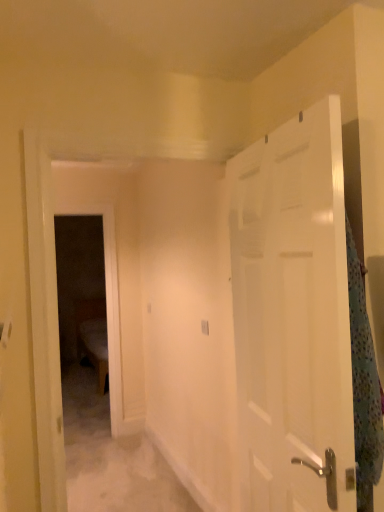
In order to face fluffy polka dot blanket at right, should I rotate leftwards or rightwards?

To face it directly, rotate right by 22.582 degrees.

This screenshot has height=512, width=384. In order to click on fluffy polka dot blanket at right in this screenshot , I will do `click(364, 383)`.

What is the approximate height of fluffy polka dot blanket at right?

fluffy polka dot blanket at right is 25.27 inches in height.

What do you see at coordinates (364, 383) in the screenshot? Image resolution: width=384 pixels, height=512 pixels. I see `fluffy polka dot blanket at right` at bounding box center [364, 383].

This screenshot has width=384, height=512. What do you see at coordinates (293, 317) in the screenshot?
I see `white glossy door at right` at bounding box center [293, 317].

This screenshot has width=384, height=512. In order to click on white glossy door at right in this screenshot , I will do `click(293, 317)`.

Locate an element on the screen. This screenshot has width=384, height=512. fluffy polka dot blanket at right is located at coordinates (364, 383).

Between fluffy polka dot blanket at right and white glossy door at right, which one appears on the left side from the viewer's perspective?

white glossy door at right.

Is fluffy polka dot blanket at right positioned before white glossy door at right?

That is False.

Does point (361, 485) come farther from viewer compared to point (271, 221)?

That is False.

From the image's perspective, which one is positioned higher, fluffy polka dot blanket at right or white glossy door at right?

fluffy polka dot blanket at right, from the image's perspective.

From a real-world perspective, is fluffy polka dot blanket at right on top of white glossy door at right?

Incorrect, from a real-world perspective, fluffy polka dot blanket at right is lower than white glossy door at right.

Between fluffy polka dot blanket at right and white glossy door at right, which one has larger width?

With larger width is white glossy door at right.

In terms of height, does fluffy polka dot blanket at right look taller or shorter compared to white glossy door at right?

Considering their sizes, fluffy polka dot blanket at right has less height than white glossy door at right.

Does fluffy polka dot blanket at right have a smaller size compared to white glossy door at right?

Yes, fluffy polka dot blanket at right is smaller than white glossy door at right.

Based on the photo, is white glossy door at right surrounded by fluffy polka dot blanket at right?

No, white glossy door at right is not inside fluffy polka dot blanket at right.

From the picture: Are fluffy polka dot blanket at right and white glossy door at right making contact?

No, fluffy polka dot blanket at right is not making contact with white glossy door at right.

Is fluffy polka dot blanket at right facing towards white glossy door at right?

No.

Find the location of a particular element. door that is below the fluffy polka dot blanket at right (from the image's perspective) is located at coordinates (293, 317).

Considering the positions of objects white glossy door at right and fluffy polka dot blanket at right in the image provided, who is more to the left, white glossy door at right or fluffy polka dot blanket at right?

Positioned to the left is white glossy door at right.

Is the position of white glossy door at right less distant than that of fluffy polka dot blanket at right?

Yes, white glossy door at right is closer to the camera.

Considering the points (256, 426) and (375, 366), which point is in front, point (256, 426) or point (375, 366)?

Point (375, 366)

From the image's perspective, which object appears higher, white glossy door at right or fluffy polka dot blanket at right?

fluffy polka dot blanket at right is shown above in the image.

From a real-world perspective, is white glossy door at right positioned under fluffy polka dot blanket at right based on gravity?

Incorrect, from a real-world perspective, white glossy door at right is higher than fluffy polka dot blanket at right.

Can you confirm if white glossy door at right is thinner than fluffy polka dot blanket at right?

No, white glossy door at right is not thinner than fluffy polka dot blanket at right.

Can you confirm if white glossy door at right is taller than fluffy polka dot blanket at right?

Yes.

Is white glossy door at right smaller than fluffy polka dot blanket at right?

Actually, white glossy door at right might be larger than fluffy polka dot blanket at right.

Is white glossy door at right spatially inside fluffy polka dot blanket at right, or outside of it?

white glossy door at right is not enclosed by fluffy polka dot blanket at right.

Is white glossy door at right with fluffy polka dot blanket at right?

No, white glossy door at right is not touching fluffy polka dot blanket at right.

Could you tell me if white glossy door at right is turned towards fluffy polka dot blanket at right?

Yes, white glossy door at right faces towards fluffy polka dot blanket at right.

Where is `blanket that is above the white glossy door at right (from the image's perspective)`? The image size is (384, 512). blanket that is above the white glossy door at right (from the image's perspective) is located at coordinates (364, 383).

The width and height of the screenshot is (384, 512). What are the coordinates of `blanket located behind the white glossy door at right` in the screenshot? It's located at (364, 383).

Find the location of a particular element. door below the fluffy polka dot blanket at right (from the image's perspective) is located at coordinates (293, 317).